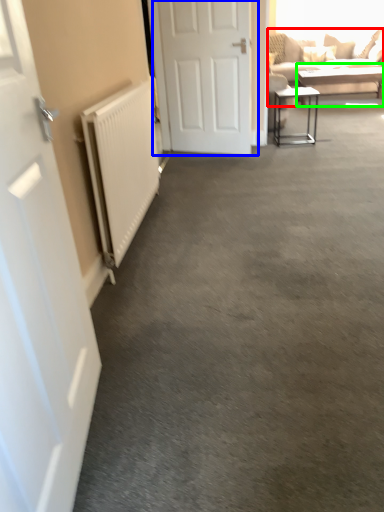
Question: Based on their relative distances, which object is nearer to studio couch (highlighted by a red box)? Choose from door (highlighted by a blue box) and table (highlighted by a green box).

Choices:
 (A) door
 (B) table

Answer: (B)